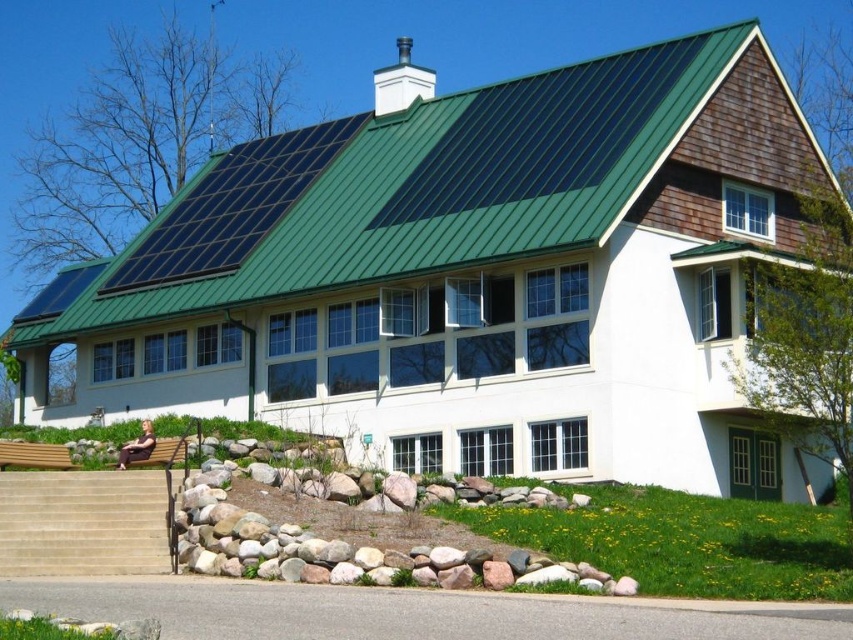
Is point (666, 74) less distant than point (108, 532)?

No, (666, 74) is further to viewer.

Does green metal roof at center appear over beige stone stairs at lower left?

Correct, green metal roof at center is located above beige stone stairs at lower left.

Does point (57, 323) come in front of point (138, 484)?

No, (57, 323) is behind (138, 484).

This screenshot has height=640, width=853. Find the location of `green metal roof at center`. green metal roof at center is located at coordinates (444, 189).